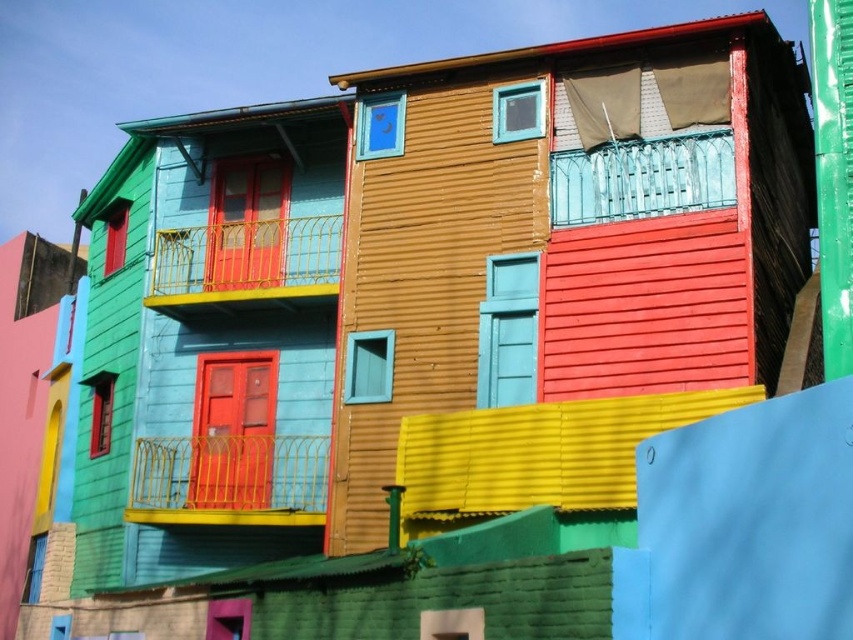
Question: From the image, what is the correct spatial relationship of yellow metal railing at upper center in relation to teal glass railing at upper center?

Choices:
 (A) below
 (B) above

Answer: (A)

Question: Which point is farther to the camera?

Choices:
 (A) (264, 296)
 (B) (666, 150)
 (C) (283, 516)

Answer: (A)

Question: In this image, where is yellow metal railing at lower center located relative to teal glass railing at upper center?

Choices:
 (A) left
 (B) right

Answer: (A)

Question: Does yellow metal railing at lower center have a smaller size compared to teal glass railing at upper center?

Choices:
 (A) no
 (B) yes

Answer: (A)

Question: Which point is farther to the camera?

Choices:
 (A) (194, 248)
 (B) (267, 486)

Answer: (A)

Question: Which point is closer to the camera taking this photo?

Choices:
 (A) (184, 241)
 (B) (622, 163)

Answer: (B)